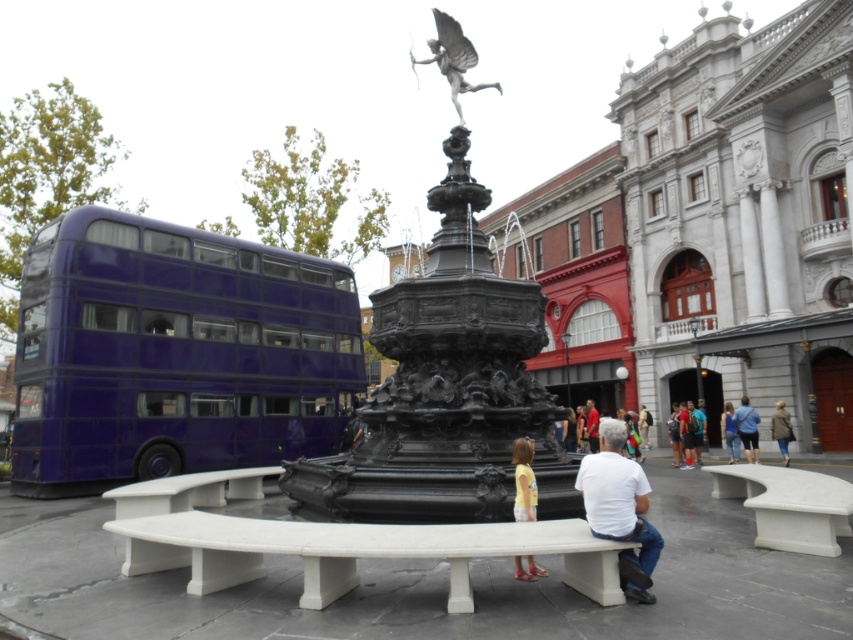
Is point (840, 531) farther from viewer compared to point (474, 58)?

No, (840, 531) is in front of (474, 58).

At what (x,y) coordinates should I click in order to perform the action: click on white marble bench at lower right. Please return your answer as a coordinate pair (x, y). The image size is (853, 640). Looking at the image, I should click on (788, 506).

Can you confirm if yellow cotton shirt at lower center is thinner than blue jeans at lower center?

Yes.

Does yellow cotton shirt at lower center come in front of blue jeans at lower center?

That is True.

Is point (527, 516) positioned behind point (726, 444)?

No, (527, 516) is in front of (726, 444).

At what (x,y) coordinates should I click in order to perform the action: click on yellow cotton shirt at lower center. Please return your answer as a coordinate pair (x, y). This screenshot has height=640, width=853. Looking at the image, I should click on (524, 481).

Can you confirm if metallic purple bus at left is taller than yellow cotton shirt at lower center?

Yes.

Does point (296, 406) lie behind point (515, 502)?

Yes, it is.

Find the location of `metallic purple bus at left`. metallic purple bus at left is located at coordinates (173, 353).